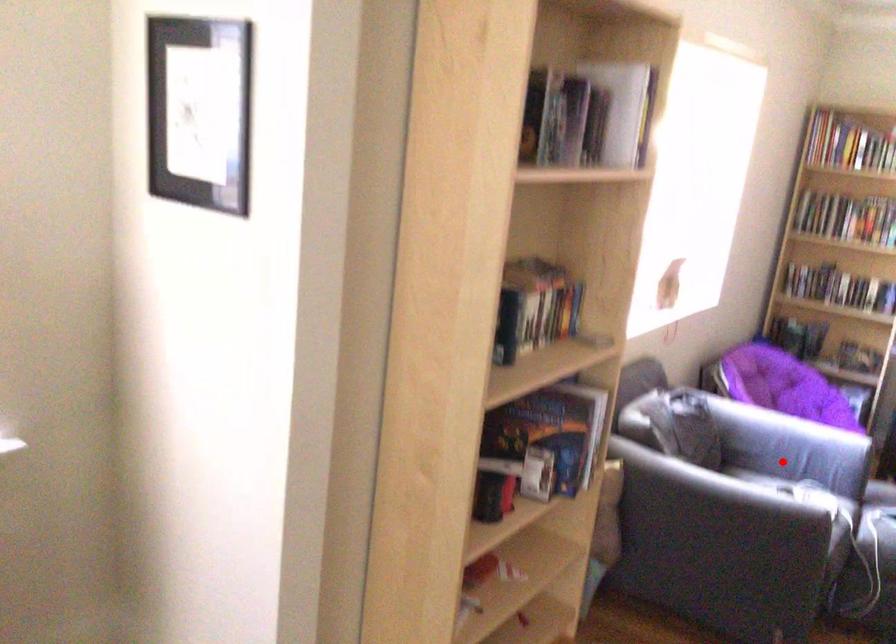
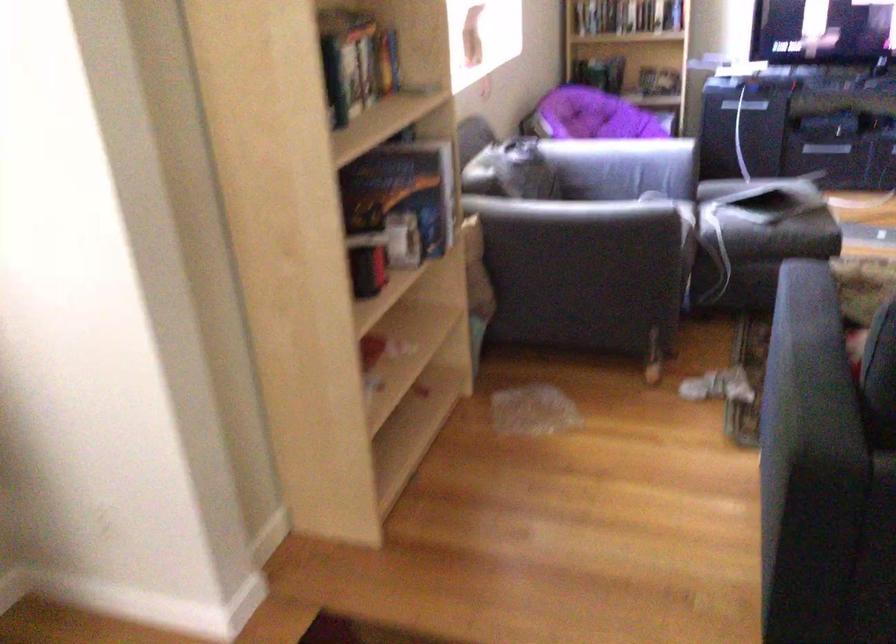
Where in the second image is the point corresponding to the highlighted location from the first image?

(614, 187)